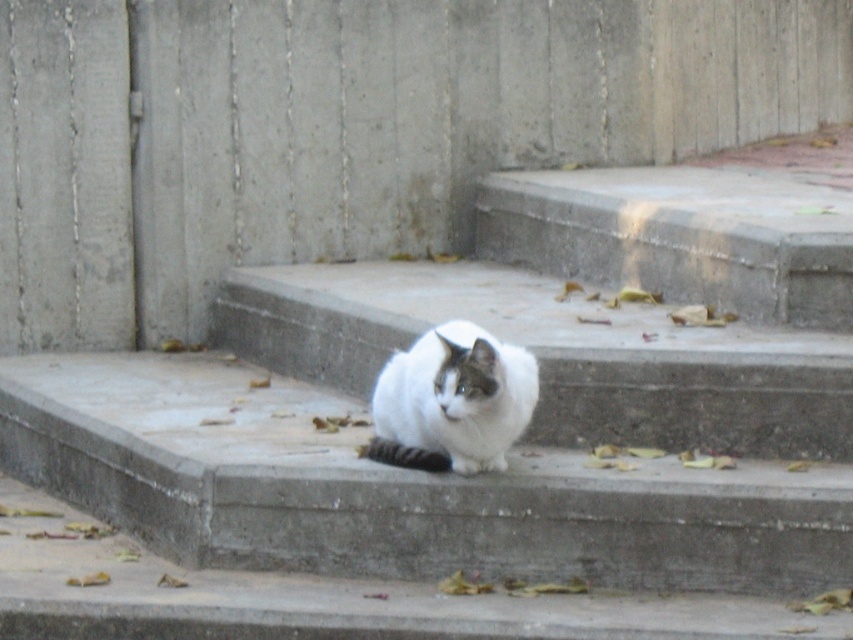
Question: Can you confirm if concrete stairs at center is positioned below white fluffy cat at center?

Choices:
 (A) yes
 (B) no

Answer: (B)

Question: Does concrete stairs at center have a smaller size compared to white fluffy cat at center?

Choices:
 (A) no
 (B) yes

Answer: (A)

Question: Among these points, which one is nearest to the camera?

Choices:
 (A) (486, 333)
 (B) (368, 285)

Answer: (A)

Question: Is concrete stairs at center bigger than white fluffy cat at center?

Choices:
 (A) no
 (B) yes

Answer: (B)